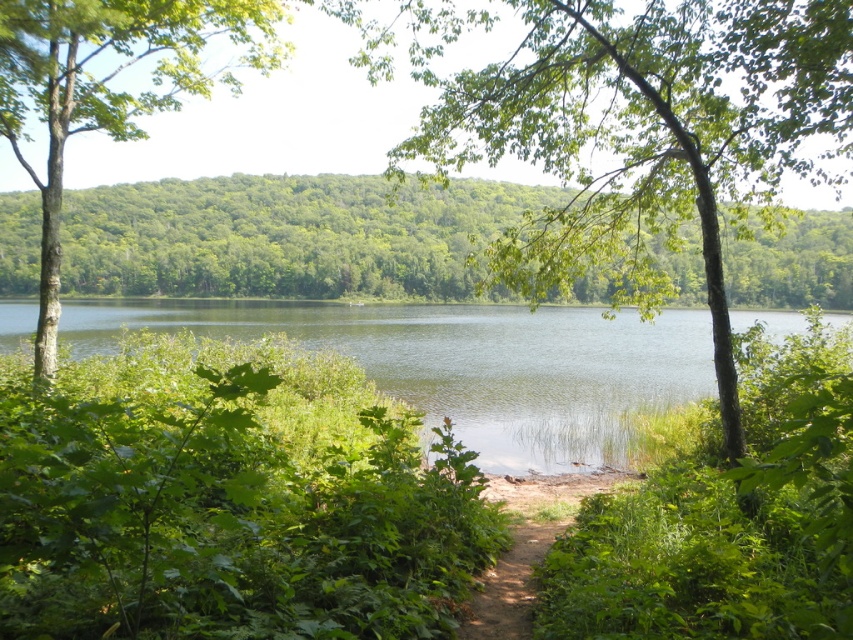
You are standing on the dirt path and want to take a photo of the clear water at center and the green leafy tree at left. Which object will appear closer to the camera in the photo?

The clear water at center will appear closer to the camera in the photo because it is in front of the green leafy tree at left.